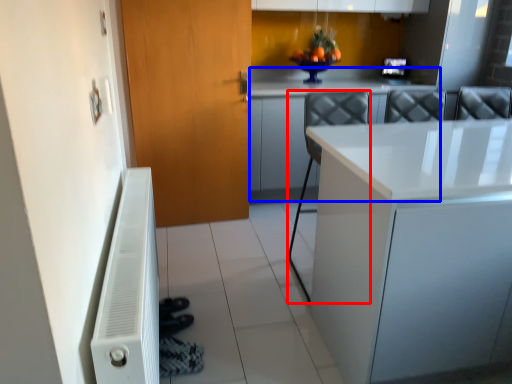
Question: Which object is further to the camera taking this photo, chair (highlighted by a red box) or counter top (highlighted by a blue box)?

Choices:
 (A) chair
 (B) counter top

Answer: (B)